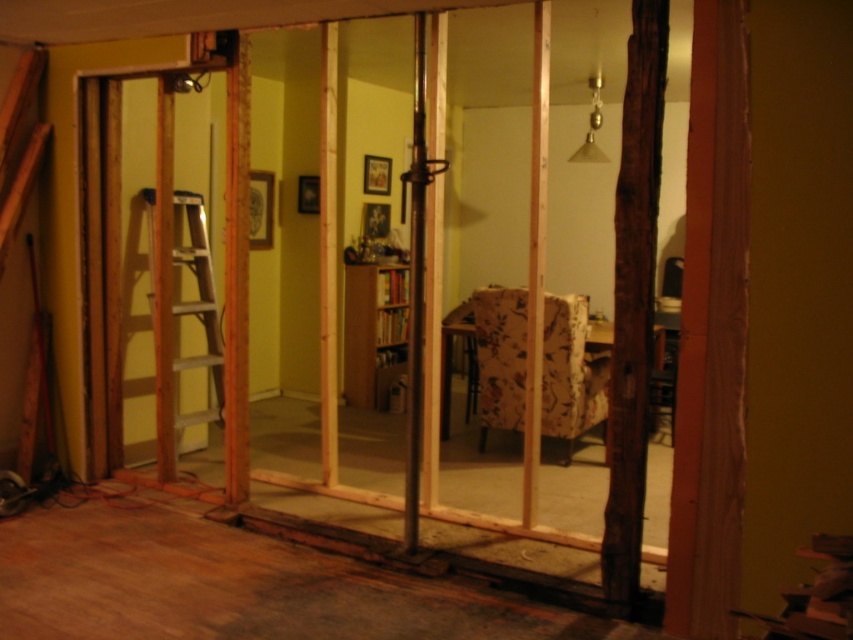
Is wooden at left smaller than wooden ladder at left?

No.

Can you confirm if wooden at left is wider than wooden ladder at left?

Indeed, wooden at left has a greater width compared to wooden ladder at left.

Who is more distant from viewer, (199, 115) or (195, 417)?

The point (199, 115) is behind.

The width and height of the screenshot is (853, 640). What are the coordinates of `wooden at left` in the screenshot? It's located at click(x=166, y=296).